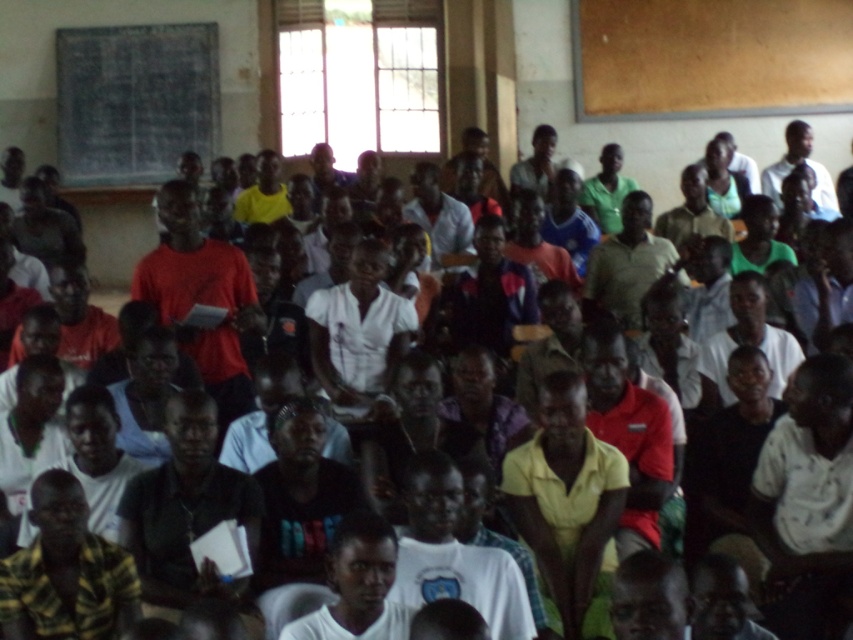
Is blackboard at upper left below matte red shirt at center?

No.

This screenshot has width=853, height=640. What do you see at coordinates (135, 100) in the screenshot?
I see `blackboard at upper left` at bounding box center [135, 100].

Identify the location of blackboard at upper left. (135, 100).

The width and height of the screenshot is (853, 640). In order to click on blackboard at upper left in this screenshot , I will do `click(135, 100)`.